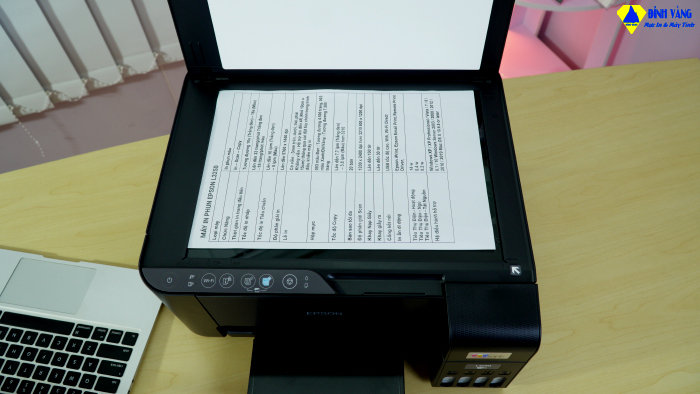
Where is `desk`? The image size is (700, 394). desk is located at coordinates (628, 252).